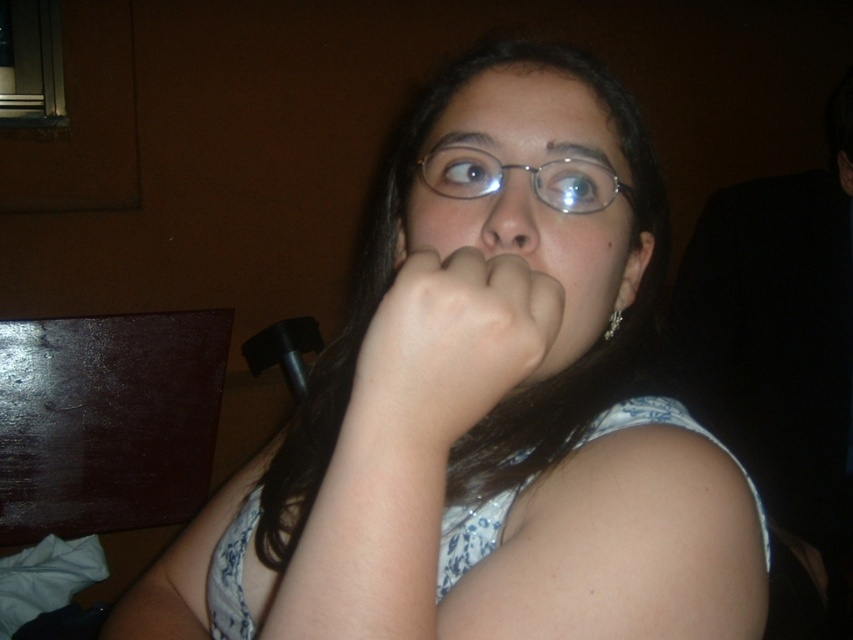
Based on the photo, you are a photographer trying to capture a closeup shot of the person in the image. You need to position your camera at a distance that allows you to focus clearly on their face while avoiding blurring the background. Given that the camera can focus sharply at 14.53 inches, can you achieve this by placing the camera exactly at the point labeled as point (412,401)?

Yes, because the distance between point (412,401) and the camera is exactly 14.53 inches, which matches the camera focus distance. This placement will ensure the person is in sharp focus while the background remains blurred.

You are standing in the room and want to place a small plant between the two points, point (552,273) and point (521,236). Which point should the plant be closer to so it is in front of the other point?

The plant should be closer to point (521,236) because point (552,273) is behind point (521,236).